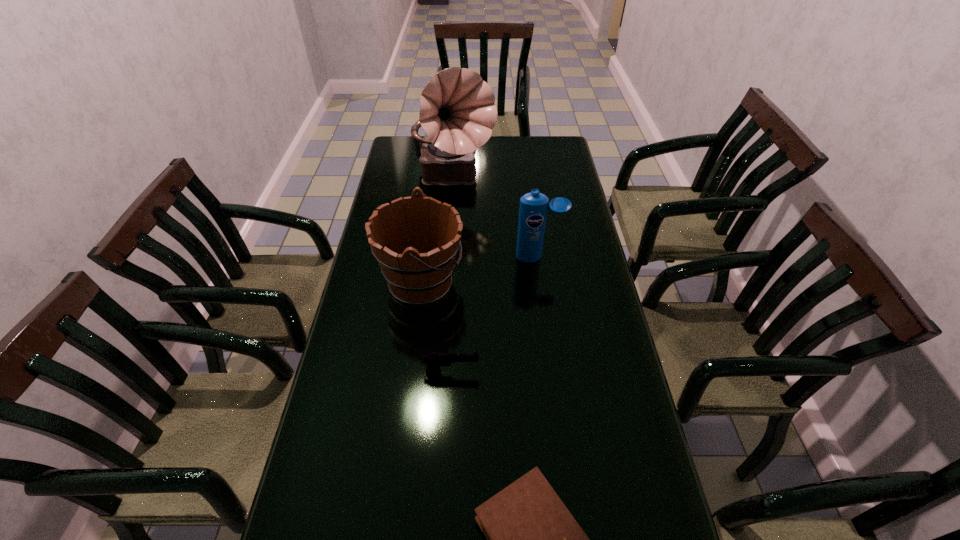
At what (x,y) coordinates should I click in order to perform the action: click on the farthest object. Please return your answer as a coordinate pair (x, y). Looking at the image, I should click on (457, 112).

You are a GUI agent. You are given a task and a screenshot of the screen. Output one action in this format:
    pyautogui.click(x=<x>, y=<y>)
    Task: Click on the tallest object
    
    Given the screenshot: What is the action you would take?
    point(457,112)

Identify the location of wine bucket. This screenshot has width=960, height=540. (421, 274).

The width and height of the screenshot is (960, 540). What are the coordinates of `shampoo` in the screenshot? It's located at (533, 209).

Locate an element on the screen. the fourth farthest object is located at coordinates (434, 360).

Find the location of a particular element. The width and height of the screenshot is (960, 540). pistol is located at coordinates (434, 360).

You are a GUI agent. You are given a task and a screenshot of the screen. Output one action in this format:
    pyautogui.click(x=<x>, y=<y>)
    Task: Click on the free space located 0.180m from the horn of the farthest object
    The width and height of the screenshot is (960, 540).
    Given the screenshot: What is the action you would take?
    pyautogui.click(x=449, y=235)

Locate an element on the screen. This screenshot has width=960, height=540. free space located 0.120m with the handle on the wine bucket is located at coordinates (502, 283).

Where is `blank space located 0.380m on the back of the shampoo`? Image resolution: width=960 pixels, height=540 pixels. blank space located 0.380m on the back of the shampoo is located at coordinates (529, 187).

Locate an element on the screen. This screenshot has height=540, width=960. vacant space located 0.140m on the front-facing side of the pistol is located at coordinates (531, 372).